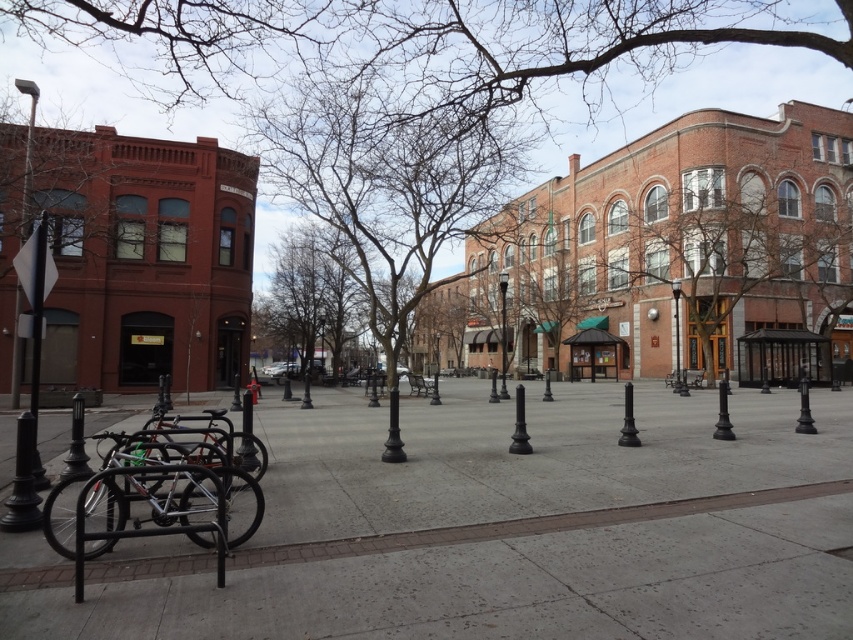
Does shiny black bicycle at lower left lie in front of polished metal lamp post at center?

Yes.

Is point (260, 452) positioned behind point (502, 344)?

No.

Find the location of a particular element. shiny black bicycle at lower left is located at coordinates (199, 440).

Locate an element on the screen. The width and height of the screenshot is (853, 640). shiny black bicycle at lower left is located at coordinates (199, 440).

Is gray concrete pavement at lower left to the left of silver metallic bicycle at lower left from the viewer's perspective?

No, gray concrete pavement at lower left is not to the left of silver metallic bicycle at lower left.

Is gray concrete pavement at lower left shorter than silver metallic bicycle at lower left?

Indeed, gray concrete pavement at lower left has a lesser height compared to silver metallic bicycle at lower left.

Who is more forward, (357, 596) or (91, 481)?

Point (357, 596)

Where is `gray concrete pavement at lower left`? The width and height of the screenshot is (853, 640). gray concrete pavement at lower left is located at coordinates (498, 529).

Who is positioned more to the right, brown textured building at upper right or black glossy pole at left?

brown textured building at upper right

Does brown textured building at upper right come in front of black glossy pole at left?

No, it is not.

Describe the element at coordinates (740, 257) in the screenshot. This screenshot has height=640, width=853. I see `brown textured building at upper right` at that location.

Where is `brown textured building at upper right`? This screenshot has width=853, height=640. brown textured building at upper right is located at coordinates (740, 257).